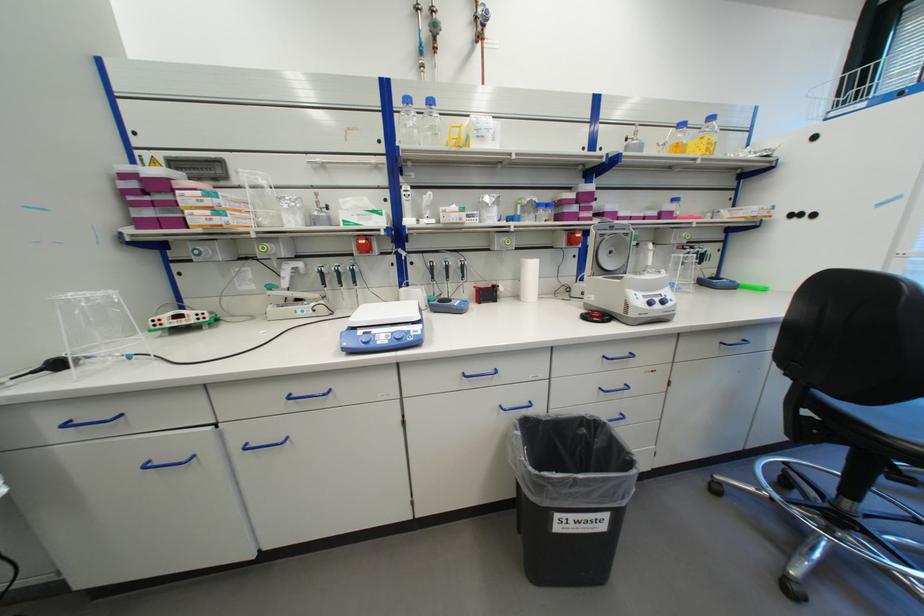
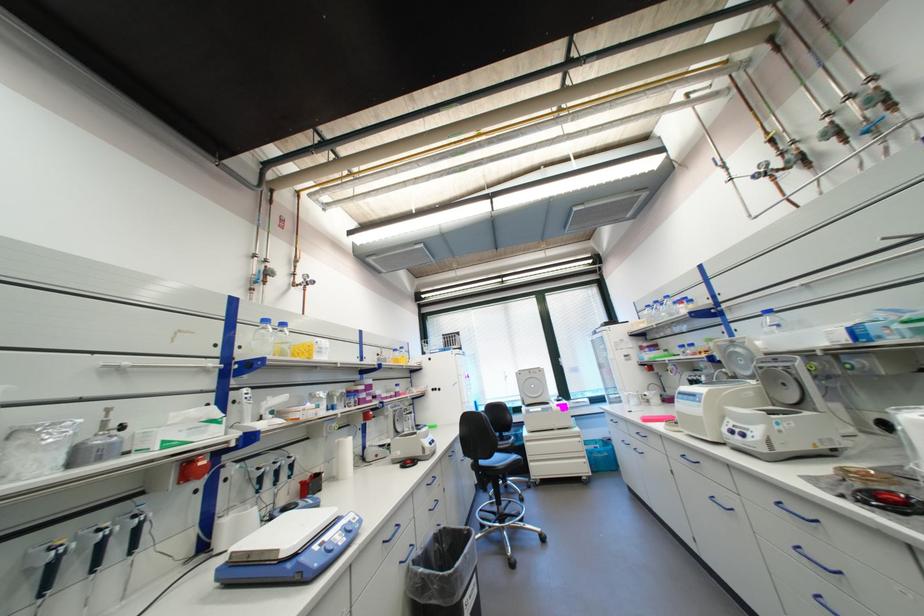
In the second image, find the point that corresponds to the point at 369,333 in the first image.

(323, 548)